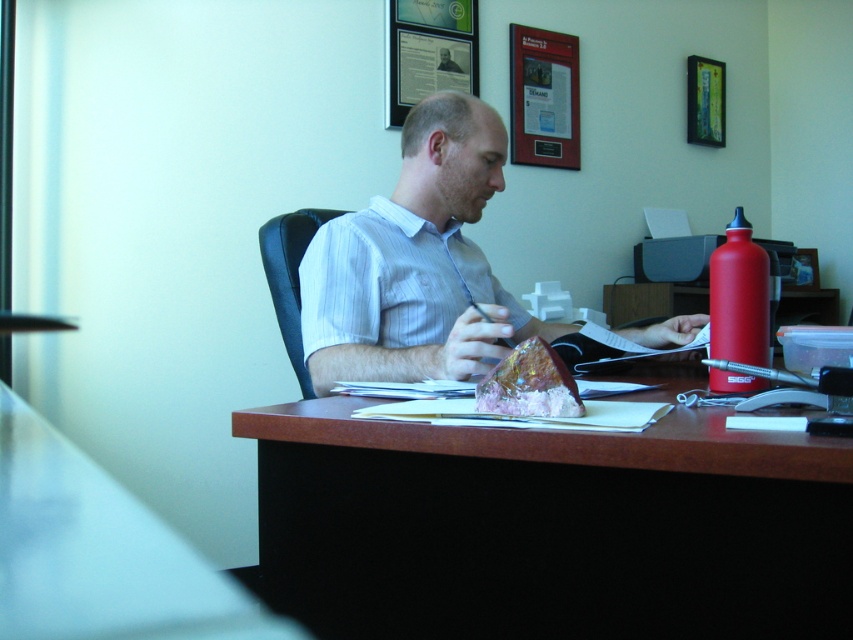
You are standing 30 inches away from the desk in the office scene. There is a point marked at coordinates point (640, 518). Can you reach that point without moving closer to the desk?

The point (640, 518) is 28.62 inches away from the viewer. Since you are standing 30 inches away from the desk, you are currently 1.38 inches farther than the point. Therefore, you can reach the point without moving closer by extending your arm or hand slightly.

You are standing in front of the office desk and want to reach the matte white shirt at center. Can you estimate how far you need to reach to touch it?

The matte white shirt at center is 1.01 meters away from the viewer, so you need to reach approximately 1.01 meters to touch it.

From the picture: You are an interior designer analyzing the office layout. You notice the matte white shirt at center and the metallic framed poster at upper center. Based on their positions, which object is closer to the ceiling?

The metallic framed poster at upper center is closer to the ceiling because it is above the matte white shirt at center.